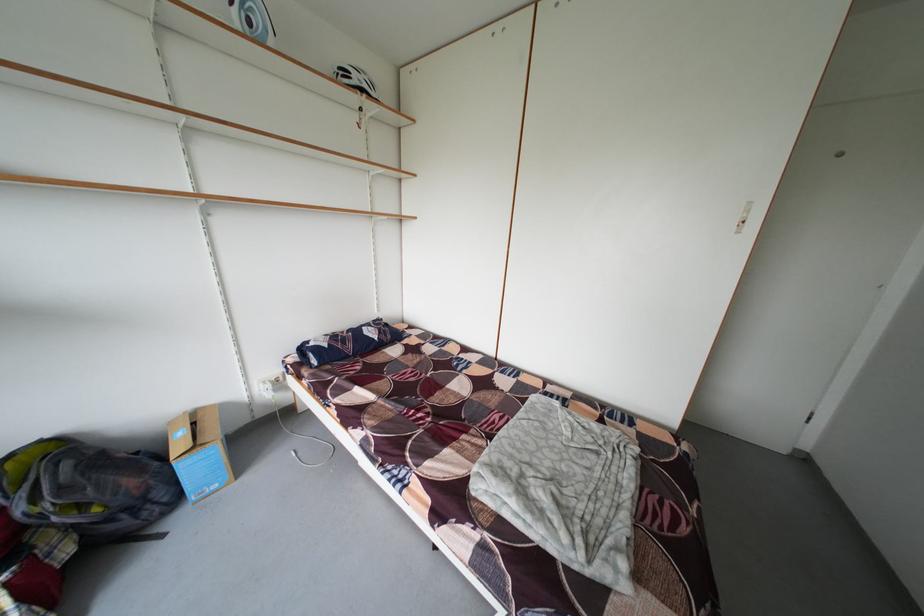
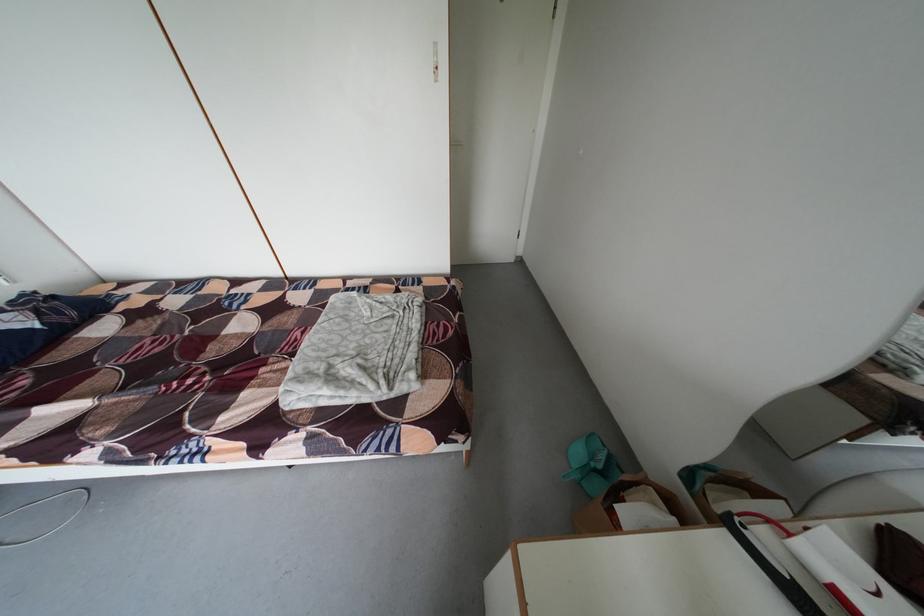
Find the pixel in the second image that matches point (506, 422) in the first image.

(309, 339)